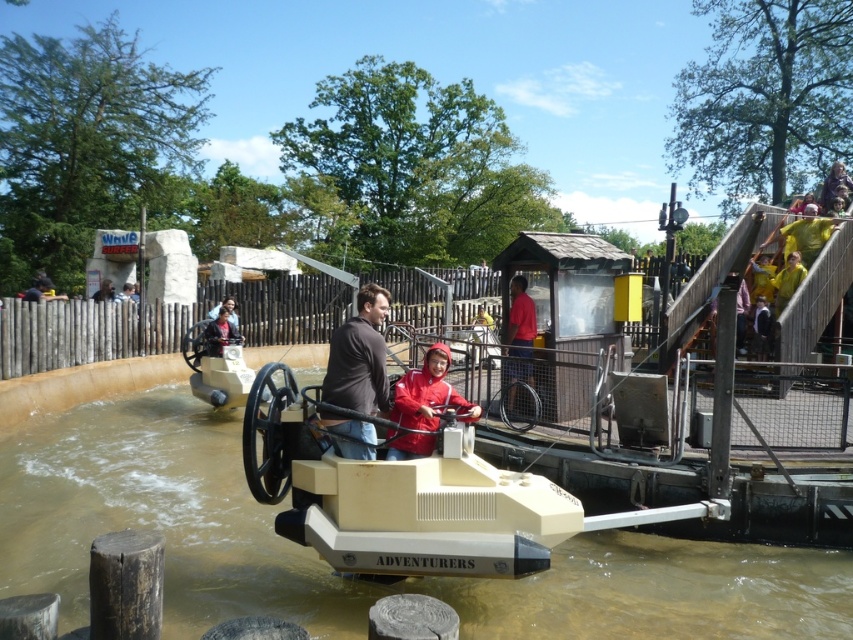
You are a park attendant checking the safety of the boats. The safety manual states that the boat must be wider than the passenger to accommodate them safely. Given the beige plastic boat at center and the matte red shirt at center, can you confirm if the boat meets the safety requirement?

The beige plastic boat at center is wider than the matte red shirt at center, so the boat meets the safety requirement.

From the picture: You are a guest at the theme park and want to take a photo of the beige plastic boat at center and the matte red shirt at center from your current position. Which object should you focus on first to ensure both are in the frame?

You should focus on the beige plastic boat at center first since it is closer to you than the matte red shirt at center, ensuring both are in the frame by adjusting the camera angle accordingly.